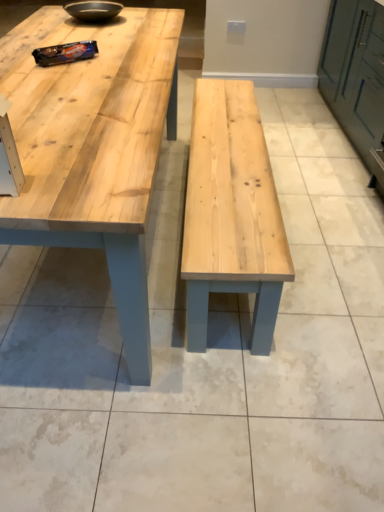
This screenshot has height=512, width=384. What do you see at coordinates (355, 71) in the screenshot?
I see `green matte cabinet at right` at bounding box center [355, 71].

Identify the location of natural wood table at center. click(x=94, y=147).

At what (x,y) coordinates should I click in order to perform the action: click on green matte cabinet at right. Please return your answer as a coordinate pair (x, y). Looking at the image, I should click on (355, 71).

From the image's perspective, does green matte cabinet at right appear higher than matte black bowl at upper center?

No, from the image's perspective, green matte cabinet at right is not on top of matte black bowl at upper center.

Is green matte cabinet at right facing towards matte black bowl at upper center?

Yes, green matte cabinet at right is turned towards matte black bowl at upper center.

Is green matte cabinet at right wider or thinner than matte black bowl at upper center?

green matte cabinet at right is wider than matte black bowl at upper center.

Does point (355, 143) appear closer or farther from the camera than point (118, 10)?

Point (355, 143) is farther from the camera than point (118, 10).

From a real-world perspective, who is located lower, green matte cabinet at right or natural wood table at center?

natural wood table at center is physically lower.

Is green matte cabinet at right at the left side of natural wood table at center?

In fact, green matte cabinet at right is to the right of natural wood table at center.

Between green matte cabinet at right and natural wood table at center, which one is positioned behind?

green matte cabinet at right is behind.

Considering the sizes of green matte cabinet at right and natural wood table at center in the image, is green matte cabinet at right wider or thinner than natural wood table at center?

Considering their sizes, green matte cabinet at right looks slimmer than natural wood table at center.

Is matte black bowl at upper center turned away from green matte cabinet at right?

No, matte black bowl at upper center's orientation is not away from green matte cabinet at right.

The image size is (384, 512). In order to click on cabinetry below the matte black bowl at upper center (from the image's perspective) in this screenshot , I will do `click(355, 71)`.

Are matte black bowl at upper center and green matte cabinet at right located far from each other?

Indeed, matte black bowl at upper center is not near green matte cabinet at right.

Considering the sizes of objects matte black bowl at upper center and green matte cabinet at right in the image provided, who is smaller, matte black bowl at upper center or green matte cabinet at right?

matte black bowl at upper center is smaller.

From a real-world perspective, is natural wood table at center on top of green matte cabinet at right?

No.

Does natural wood table at center appear on the right side of green matte cabinet at right?

No.

Based on the photo, would you say natural wood table at center is outside green matte cabinet at right?

natural wood table at center lies outside green matte cabinet at right's area.

Looking at this image, from a real-world perspective, which object stands above the other?

matte black bowl at upper center.

Considering the relative positions of natural wood table at center and matte black bowl at upper center in the image provided, is natural wood table at center in front of matte black bowl at upper center?

That is True.

From the image's perspective, between natural wood table at center and matte black bowl at upper center, which one is located above?

matte black bowl at upper center, from the image's perspective.

Locate an element on the screen. This screenshot has width=384, height=512. bowl above the natural wood table at center (from a real-world perspective) is located at coordinates (94, 10).

In terms of size, does matte black bowl at upper center appear bigger or smaller than natural wood table at center?

Clearly, matte black bowl at upper center is smaller in size than natural wood table at center.

Between matte black bowl at upper center and natural wood table at center, which one appears on the left side from the viewer's perspective?

matte black bowl at upper center.

Is there a large distance between matte black bowl at upper center and natural wood table at center?

No, there isn't a large distance between matte black bowl at upper center and natural wood table at center.

This screenshot has height=512, width=384. What are the coordinates of `bowl above the green matte cabinet at right (from the image's perspective)` in the screenshot? It's located at (94, 10).

Find the location of `cabinetry on the right of natural wood table at center`. cabinetry on the right of natural wood table at center is located at coordinates (355, 71).

Looking at the image, which one is located further to matte black bowl at upper center, natural wood table at center or green matte cabinet at right?

green matte cabinet at right lies further to matte black bowl at upper center than the other object.

From the image, which object appears to be farther from matte black bowl at upper center, green matte cabinet at right or natural wood table at center?

green matte cabinet at right is positioned further to the anchor matte black bowl at upper center.

Looking at the image, which one is located closer to natural wood table at center, matte black bowl at upper center or green matte cabinet at right?

The object closer to natural wood table at center is matte black bowl at upper center.

Considering their positions, is matte black bowl at upper center positioned further to green matte cabinet at right than natural wood table at center?

Among the two, matte black bowl at upper center is located further to green matte cabinet at right.

Estimate the real-world distances between objects in this image. Which object is further from green matte cabinet at right, natural wood table at center or matte black bowl at upper center?

matte black bowl at upper center lies further to green matte cabinet at right than the other object.

Based on their spatial positions, is green matte cabinet at right or matte black bowl at upper center closer to natural wood table at center?

matte black bowl at upper center lies closer to natural wood table at center than the other object.

You are a GUI agent. You are given a task and a screenshot of the screen. Output one action in this format:
    pyautogui.click(x=<x>, y=<y>)
    Task: Click on the table located between matte black bowl at upper center and green matte cabinet at right in the left-right direction
    The image size is (384, 512).
    Given the screenshot: What is the action you would take?
    pyautogui.click(x=94, y=147)